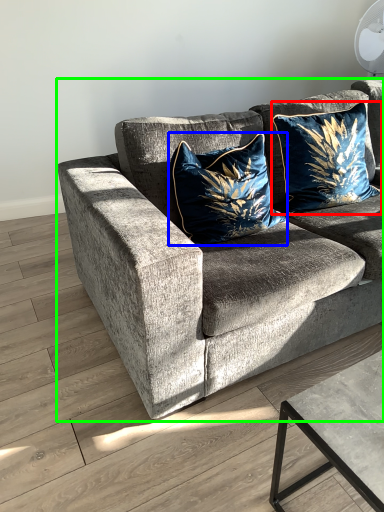
Question: Which is farther away from pillow (highlighted by a red box)? pillow (highlighted by a blue box) or studio couch (highlighted by a green box)?

Choices:
 (A) pillow
 (B) studio couch

Answer: (B)